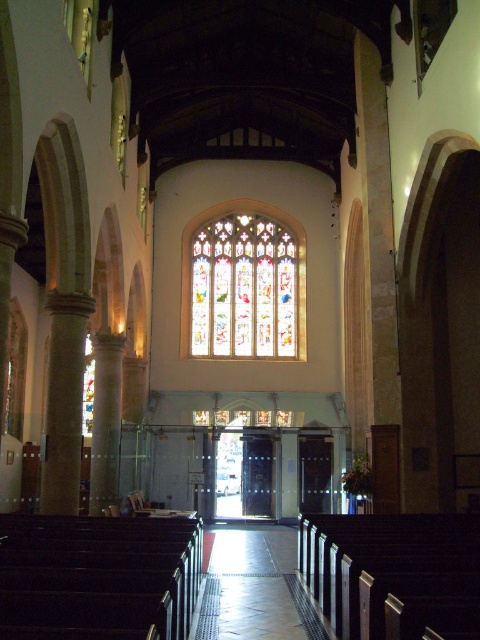
Question: Observing the image, what is the correct spatial positioning of stained glass window at center in reference to shiny metallic aisle at center?

Choices:
 (A) right
 (B) left

Answer: (B)

Question: Which point is closer to the camera taking this photo?

Choices:
 (A) (290, 250)
 (B) (292, 566)

Answer: (B)

Question: Does stained glass window at center have a smaller size compared to shiny metallic aisle at center?

Choices:
 (A) no
 (B) yes

Answer: (A)

Question: Observing the image, what is the correct spatial positioning of stained glass window at center in reference to shiny metallic aisle at center?

Choices:
 (A) below
 (B) above

Answer: (B)